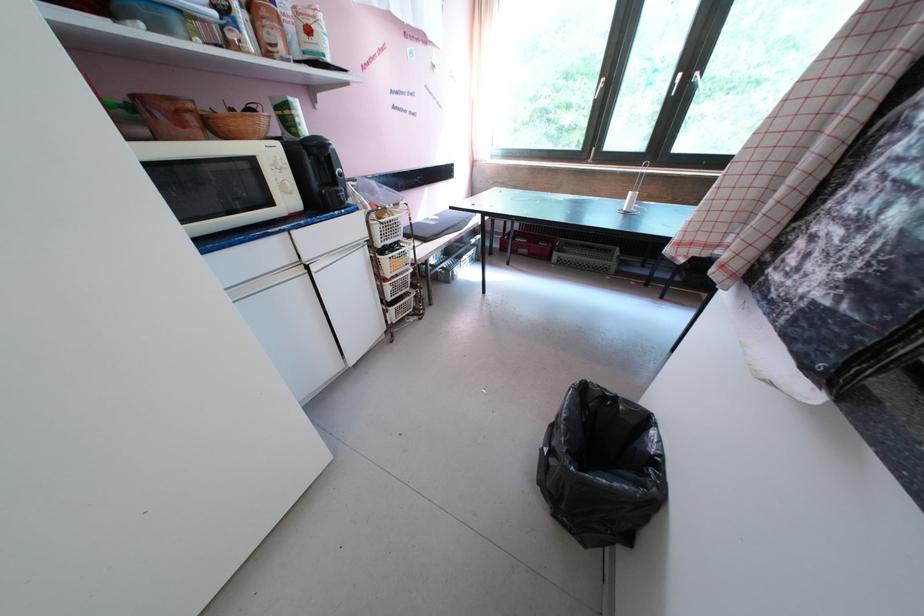
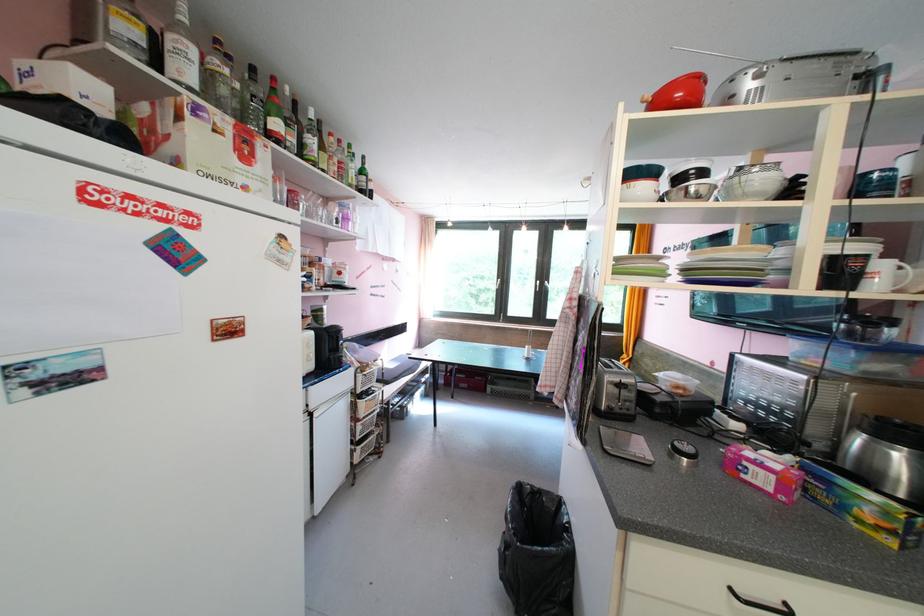
Based on the continuous images, in which direction is the camera rotating?

The camera rotated toward right-up.